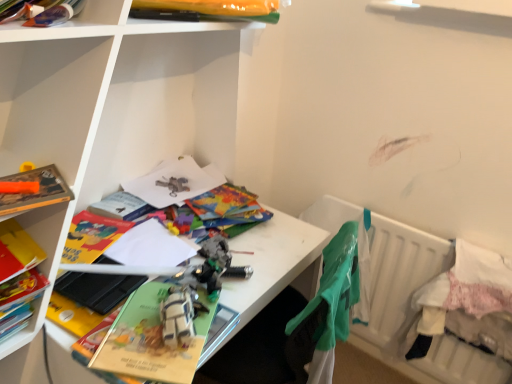
Question: Is white fabric bed at lower right, which appears as the 1th bed when viewed from the front, taller or shorter than yellow plastic bag at upper center, which appears as the second book when ordered from the bottom?

Choices:
 (A) tall
 (B) short

Answer: (A)

Question: From a real-world perspective, is white fabric bed at lower right, the 2th bed positioned from the back, physically located above or below yellow plastic bag at upper center, which ranks as the 2th book in left-to-right order?

Choices:
 (A) below
 (B) above

Answer: (A)

Question: Which is nearer to the white plastic bed at lower right, which is the 1th bed in back-to-front order?

Choices:
 (A) matte plastic books at upper left, acting as the second shelf starting from the front
 (B) hardcover book at left, arranged as the first book when viewed from the left
 (C) white matte desk at center, acting as the first shelf starting from the front
 (D) green fabric at right
 (E) white fabric bed at lower right, the 2th bed positioned from the back

Answer: (E)

Question: Which object is the closest to the white fabric bed at lower right, the 2th bed positioned from the back?

Choices:
 (A) white matte desk at center, which is the 2th shelf in left-to-right order
 (B) matte green paperback book at center, placed as the 2th paperback book when sorted from top to bottom
 (C) white plastic bed at lower right, positioned as the second bed in front-to-back order
 (D) hardcover book at left, arranged as the first book when viewed from the left
 (E) white plastic toy at center

Answer: (C)